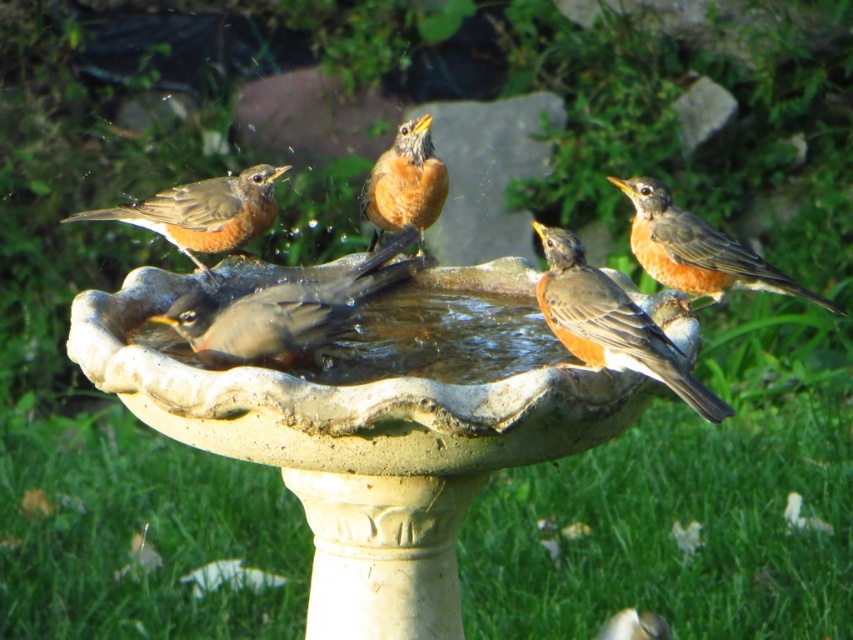
Question: Does brown matte bird at center appear under bright orange bird at center?

Choices:
 (A) yes
 (B) no

Answer: (A)

Question: Which of the following is the farthest from the observer?

Choices:
 (A) (207, 240)
 (B) (265, 292)

Answer: (A)

Question: Which point is closer to the camera taking this photo?

Choices:
 (A) (148, 214)
 (B) (363, 272)
 (C) (672, 220)

Answer: (B)

Question: Can you confirm if brown matte bird at right is thinner than bright orange bird at center?

Choices:
 (A) no
 (B) yes

Answer: (A)

Question: Among these objects, which one is nearest to the camera?

Choices:
 (A) brown matte bird at right
 (B) brown matte bird at center
 (C) brown matte bird at left

Answer: (B)

Question: Does brown matte bird at center appear on the left side of brown matte bird at right?

Choices:
 (A) yes
 (B) no

Answer: (A)